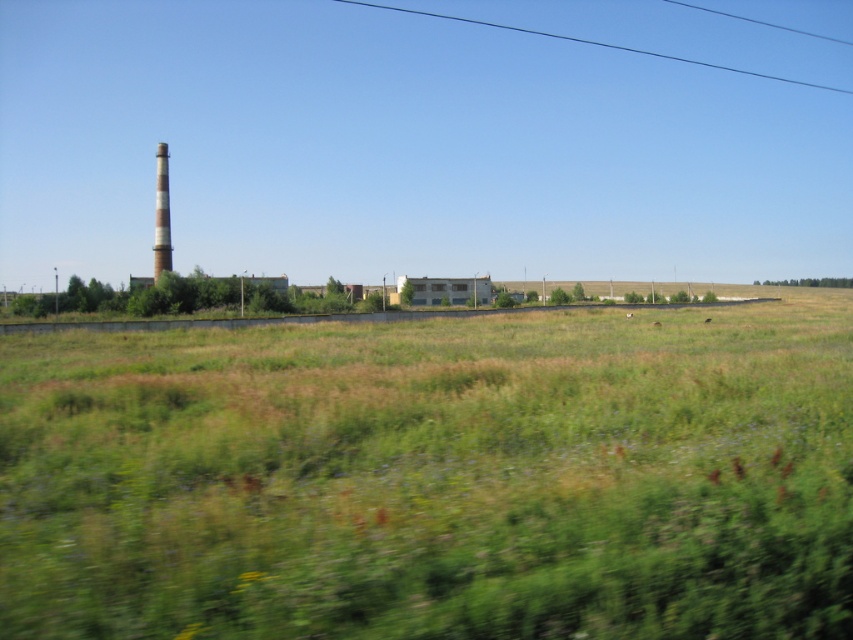
Question: Among these points, which one is farthest from the camera?

Choices:
 (A) (662, 54)
 (B) (158, 236)

Answer: (A)

Question: Which of the following is the closest to the observer?

Choices:
 (A) green grassy field at center
 (B) black wire at upper center
 (C) white striped chimney at left

Answer: (A)

Question: Among these objects, which one is nearest to the camera?

Choices:
 (A) green grassy field at center
 (B) white striped chimney at left
 (C) black wire at upper center

Answer: (A)

Question: Does green grassy field at center appear on the left side of black wire at upper center?

Choices:
 (A) yes
 (B) no

Answer: (A)

Question: Can you confirm if green grassy field at center is positioned to the left of white striped chimney at left?

Choices:
 (A) no
 (B) yes

Answer: (A)

Question: Does black wire at upper center have a smaller size compared to white striped chimney at left?

Choices:
 (A) no
 (B) yes

Answer: (B)